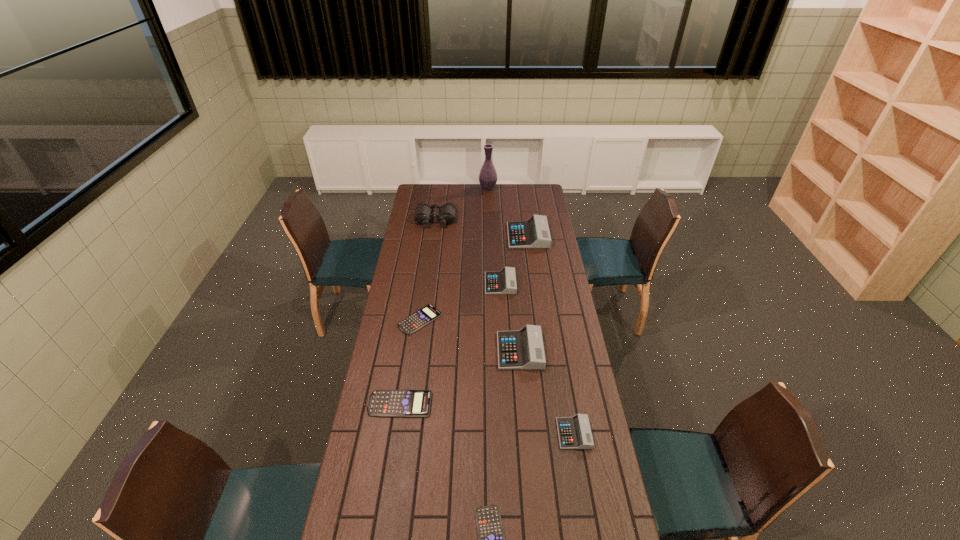
Where is `vacant area located on the front of the smallest gray calculator`? The width and height of the screenshot is (960, 540). vacant area located on the front of the smallest gray calculator is located at coordinates (582, 482).

This screenshot has width=960, height=540. Find the location of `vacant space located 0.230m on the front of the biggest blue calculator`. vacant space located 0.230m on the front of the biggest blue calculator is located at coordinates (388, 482).

I want to click on vacant region located on the back of the sixth tallest calculator, so click(x=424, y=288).

Identify the location of object that is at the far edge. The height and width of the screenshot is (540, 960). (488, 176).

Image resolution: width=960 pixels, height=540 pixels. Find the location of `binoculars situated at the left edge`. binoculars situated at the left edge is located at coordinates 423,213.

What are the coordinates of `vacant space at the far edge of the desktop` in the screenshot? It's located at (510, 194).

Where is `vacant area at the left edge`? vacant area at the left edge is located at coordinates (428, 256).

Where is `vacant space at the right edge of the desktop`? This screenshot has width=960, height=540. vacant space at the right edge of the desktop is located at coordinates (554, 283).

Find the location of a particular element. The image size is (960, 540). free location at the far left corner of the desktop is located at coordinates (435, 204).

The width and height of the screenshot is (960, 540). Identify the location of vacant area between the third nearest object and the second smallest blue calculator. (410, 362).